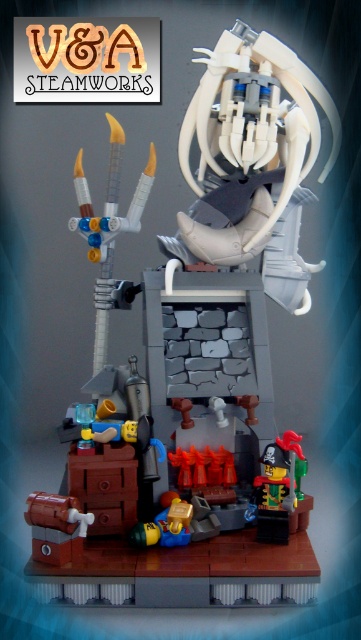
Question: Which point appears farthest from the camera in this image?

Choices:
 (A) (150, 148)
 (B) (267, 177)

Answer: (B)

Question: Can you confirm if white matte/porcelain head at upper center is smaller than translucent white plastic staff at left?

Choices:
 (A) yes
 (B) no

Answer: (B)

Question: Among these objects, which one is farthest from the camera?

Choices:
 (A) white matte/porcelain head at upper center
 (B) translucent white plastic staff at left

Answer: (B)

Question: Is white matte/porcelain head at upper center further to the viewer compared to translucent white plastic staff at left?

Choices:
 (A) yes
 (B) no

Answer: (B)

Question: Does white matte/porcelain head at upper center have a greater width compared to translucent white plastic staff at left?

Choices:
 (A) yes
 (B) no

Answer: (A)